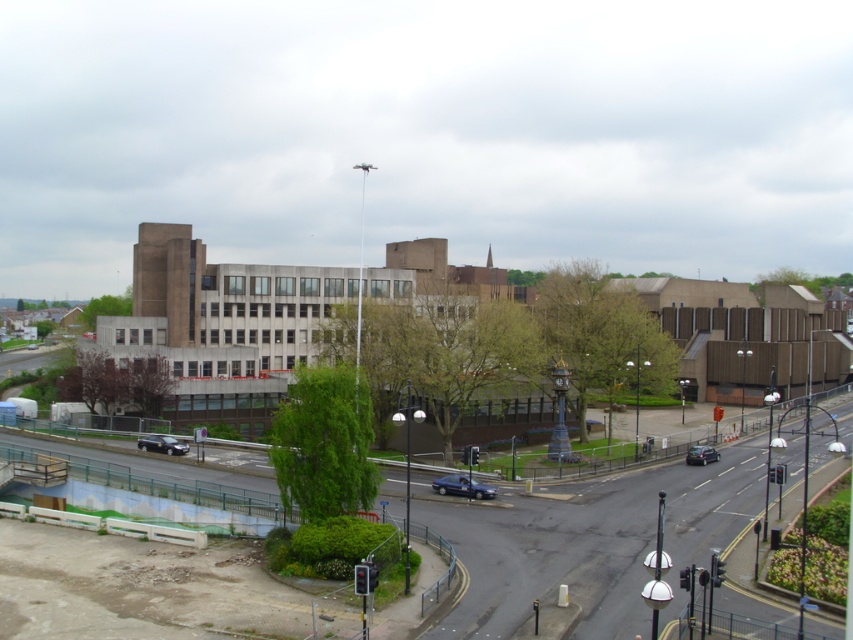
Between point (142, 444) and point (688, 451), which one is positioned behind?

Positioned behind is point (688, 451).

Measure the distance between shiny black sedan at lower left and camera.

shiny black sedan at lower left and camera are 70.46 meters apart.

Image resolution: width=853 pixels, height=640 pixels. I want to click on shiny black sedan at lower left, so click(161, 444).

Between metallic blue sedan at center and shiny black sedan at lower left, which one is positioned lower?

metallic blue sedan at center is lower down.

Consider the image. Between metallic blue sedan at center and shiny black sedan at lower left, which one is positioned higher?

shiny black sedan at lower left is higher up.

Does point (451, 477) come closer to viewer compared to point (154, 440)?

That is True.

Locate an element on the screen. The width and height of the screenshot is (853, 640). metallic blue sedan at center is located at coordinates (462, 486).

In the scene shown: Does metallic blue sedan at center have a greater width compared to shiny black sedan at lower right?

No, metallic blue sedan at center is not wider than shiny black sedan at lower right.

Which is more to the left, metallic blue sedan at center or shiny black sedan at lower right?

metallic blue sedan at center

I want to click on metallic blue sedan at center, so click(x=462, y=486).

Where is `metallic blue sedan at center`? Image resolution: width=853 pixels, height=640 pixels. metallic blue sedan at center is located at coordinates (462, 486).